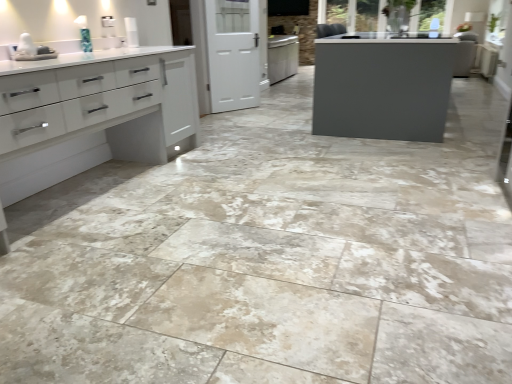
Question: From the image's perspective, is white glossy cabinet at left located beneath white matte screen door at center?

Choices:
 (A) no
 (B) yes

Answer: (B)

Question: Is white glossy cabinet at left closer to the viewer compared to white matte screen door at center?

Choices:
 (A) no
 (B) yes

Answer: (B)

Question: From a real-world perspective, does white glossy cabinet at left sit lower than white matte screen door at center?

Choices:
 (A) no
 (B) yes

Answer: (B)

Question: Can you confirm if white glossy cabinet at left is positioned to the left of white matte screen door at center?

Choices:
 (A) yes
 (B) no

Answer: (A)

Question: Could you tell me if white glossy cabinet at left is turned towards white matte screen door at center?

Choices:
 (A) no
 (B) yes

Answer: (A)

Question: From a real-world perspective, relative to white glossy sink at upper left, is white glossy cabinet at left vertically above or below?

Choices:
 (A) below
 (B) above

Answer: (A)

Question: Is white glossy cabinet at left inside or outside of white glossy sink at upper left?

Choices:
 (A) inside
 (B) outside

Answer: (B)

Question: Looking at their shapes, would you say white glossy cabinet at left is wider or thinner than white glossy sink at upper left?

Choices:
 (A) wide
 (B) thin

Answer: (A)

Question: Would you say white glossy cabinet at left is to the left or to the right of white glossy sink at upper left in the picture?

Choices:
 (A) left
 (B) right

Answer: (B)

Question: Considering the positions of point (184, 87) and point (231, 62), is point (184, 87) closer or farther from the camera than point (231, 62)?

Choices:
 (A) closer
 (B) farther

Answer: (A)

Question: From their relative heights in the image, would you say white glossy cabinet at left is taller or shorter than white matte screen door at center?

Choices:
 (A) tall
 (B) short

Answer: (B)

Question: From a real-world perspective, is white glossy cabinet at left positioned above or below white matte screen door at center?

Choices:
 (A) above
 (B) below

Answer: (B)

Question: In the image, is white glossy cabinet at left on the left side or the right side of white matte screen door at center?

Choices:
 (A) left
 (B) right

Answer: (A)

Question: In terms of size, does white glossy sink at upper left appear bigger or smaller than white matte screen door at center?

Choices:
 (A) big
 (B) small

Answer: (B)

Question: Does point (23, 59) appear closer or farther from the camera than point (240, 104)?

Choices:
 (A) closer
 (B) farther

Answer: (A)